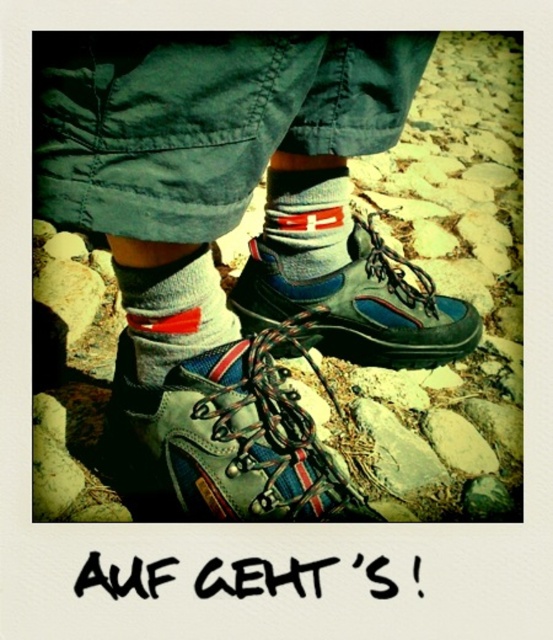
Question: Among these objects, which one is nearest to the camera?

Choices:
 (A) blue suede hiking boot at center
 (B) matte gray hiking boots at center
 (C) gray cotton sock at center
 (D) white textured sock at center

Answer: (B)

Question: Can you confirm if matte gray hiking boots at center is wider than blue suede hiking boot at center?

Choices:
 (A) no
 (B) yes

Answer: (B)

Question: Which point is farther from the camera taking this photo?

Choices:
 (A) (181, 300)
 (B) (229, 374)
 (C) (129, 308)
 (D) (301, 214)

Answer: (D)

Question: Is leather hiking boot at center positioned in front of blue suede hiking boot at center?

Choices:
 (A) yes
 (B) no

Answer: (A)

Question: Which of the following is the farthest from the observer?

Choices:
 (A) pos(189,333)
 (B) pos(440,358)

Answer: (B)

Question: Is white textured sock at center bigger than gray cotton sock at center?

Choices:
 (A) yes
 (B) no

Answer: (A)